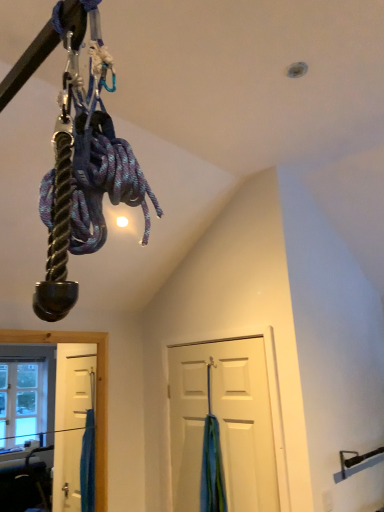
Measure the distance between point (211, 422) and camera.

7.80 feet.

The image size is (384, 512). Describe the element at coordinates (212, 461) in the screenshot. I see `blue fabric at door` at that location.

Where is `blue fabric at door`? blue fabric at door is located at coordinates (212, 461).

Image resolution: width=384 pixels, height=512 pixels. What do you see at coordinates (227, 422) in the screenshot? I see `white matte door at center` at bounding box center [227, 422].

The width and height of the screenshot is (384, 512). In order to click on white matte door at center in this screenshot , I will do `click(227, 422)`.

Where is `blue fabric at door`? The height and width of the screenshot is (512, 384). blue fabric at door is located at coordinates (212, 461).

Between blue fabric at door and white matte door at center, which one appears on the right side from the viewer's perspective?

white matte door at center is more to the right.

Between blue fabric at door and white matte door at center, which one is positioned in front?

white matte door at center.

Considering the points (216, 421) and (192, 397), which point is in front, point (216, 421) or point (192, 397)?

The point (216, 421) is closer to the camera.

Looking at this image, from the image's perspective, is blue fabric at door on white matte door at center?

Incorrect, from the image's perspective, blue fabric at door is lower than white matte door at center.

From a real-world perspective, between blue fabric at door and white matte door at center, who is vertically lower?

blue fabric at door.

Which object is thinner, blue fabric at door or white matte door at center?

With smaller width is white matte door at center.

Can you confirm if blue fabric at door is taller than white matte door at center?

No, blue fabric at door is not taller than white matte door at center.

Considering the sizes of blue fabric at door and white matte door at center in the image, is blue fabric at door bigger or smaller than white matte door at center?

In the image, blue fabric at door appears to be smaller than white matte door at center.

From the picture: Is blue fabric at door located outside white matte door at center?

Yes, blue fabric at door is outside of white matte door at center.

Is blue fabric at door beside white matte door at center?

blue fabric at door is not next to white matte door at center, and they're not touching.

Does blue fabric at door turn towards white matte door at center?

Yes, blue fabric at door is oriented towards white matte door at center.

What's the angular difference between blue fabric at door and white matte door at center's facing directions?

0.00102 degrees.

Measure the distance between blue fabric at door and white matte door at center.

blue fabric at door is 6.27 inches away from white matte door at center.

The height and width of the screenshot is (512, 384). In order to click on curtain below the white matte door at center (from the image's perspective) in this screenshot , I will do `click(212, 461)`.

Considering the relative positions of white matte door at center and blue fabric at door in the image provided, is white matte door at center to the right of blue fabric at door from the viewer's perspective?

Indeed, white matte door at center is positioned on the right side of blue fabric at door.

Between white matte door at center and blue fabric at door, which one is positioned behind?

blue fabric at door is further from the camera.

Considering the points (188, 411) and (209, 420), which point is in front, point (188, 411) or point (209, 420)?

Point (209, 420)

From the image's perspective, relative to blue fabric at door, is white matte door at center above or below?

Clearly, from the image's perspective, white matte door at center is above blue fabric at door.

From a real-world perspective, which is physically above, white matte door at center or blue fabric at door?

white matte door at center.

Which object is thinner, white matte door at center or blue fabric at door?

With smaller width is white matte door at center.

Is white matte door at center taller than blue fabric at door?

Yes, white matte door at center is taller than blue fabric at door.

Is white matte door at center bigger than blue fabric at door?

Correct, white matte door at center is larger in size than blue fabric at door.

Would you say white matte door at center is outside blue fabric at door?

Yes, white matte door at center is not within blue fabric at door.

Is white matte door at center next to blue fabric at door and touching it?

They are not placed beside each other.

Is white matte door at center turned away from blue fabric at door?

Yes, white matte door at center is positioned with its back facing blue fabric at door.

What's the angular difference between white matte door at center and blue fabric at door's facing directions?

The facing directions of white matte door at center and blue fabric at door are 0.00102 degrees apart.

Locate an element on the screen. The image size is (384, 512). door located in front of the blue fabric at door is located at coordinates (227, 422).

At what (x,y) coordinates should I click in order to perform the action: click on curtain on the left side of white matte door at center. Please return your answer as a coordinate pair (x, y). Image resolution: width=384 pixels, height=512 pixels. Looking at the image, I should click on (212, 461).

The image size is (384, 512). In order to click on door above the blue fabric at door (from the image's perspective) in this screenshot , I will do `click(227, 422)`.